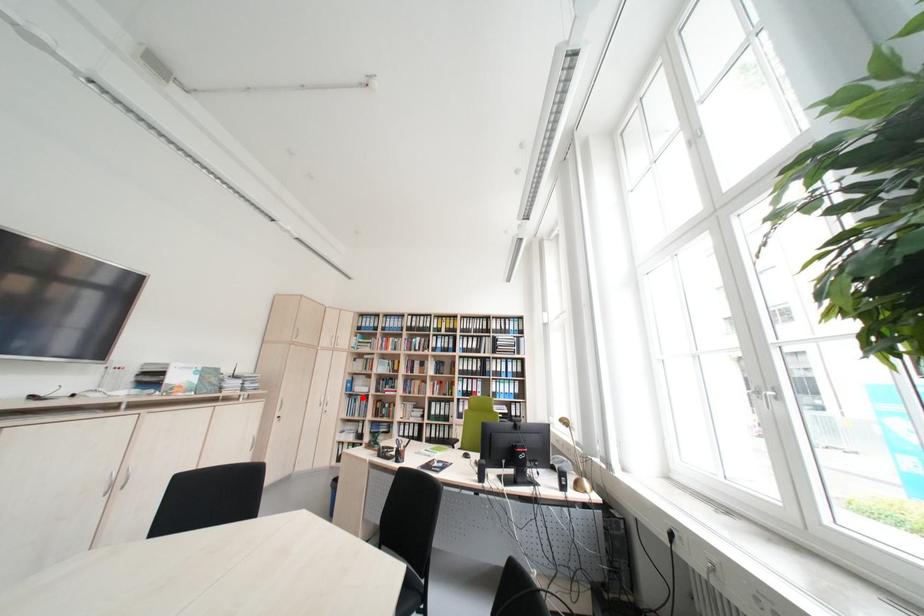
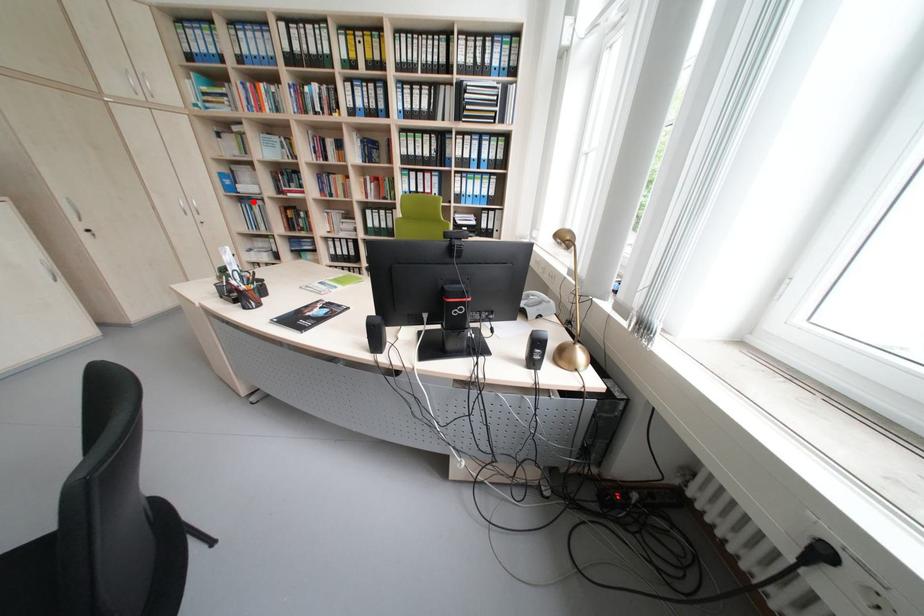
I am providing you with two images of the same scene from different viewpoints. A red point is marked on the first image and another point is marked on the second image. Does the point marked in image1 correspond to the same location as the one in image2?

Yes